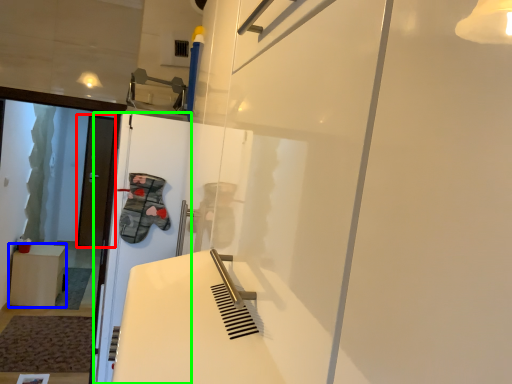
Question: Estimate the real-world distances between objects in this image. Which object is closer to door (highlighted by a red box), furniture (highlighted by a blue box) or screen door (highlighted by a green box)?

Choices:
 (A) furniture
 (B) screen door

Answer: (A)